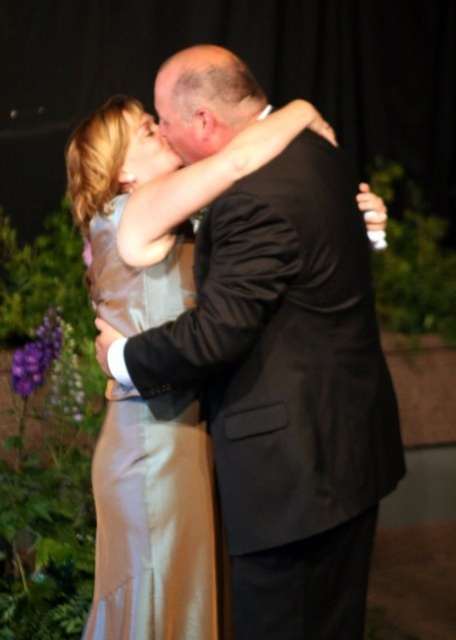
Does satin dress at center appear under satin dress at left?

Incorrect, satin dress at center is not positioned below satin dress at left.

Is satin dress at center to the left of satin dress at left from the viewer's perspective?

Incorrect, satin dress at center is not on the left side of satin dress at left.

Where is `satin dress at center`? satin dress at center is located at coordinates (285, 392).

Does satin dress at center appear over bald head at center?

No.

The image size is (456, 640). What do you see at coordinates (285, 392) in the screenshot?
I see `satin dress at center` at bounding box center [285, 392].

The height and width of the screenshot is (640, 456). I want to click on satin dress at center, so click(x=285, y=392).

Does satin dress at left lie behind bald head at center?

Yes, satin dress at left is behind bald head at center.

You are a GUI agent. You are given a task and a screenshot of the screen. Output one action in this format:
    pyautogui.click(x=<x>, y=<y>)
    Task: Click on the satin dress at left
    Image resolution: width=456 pixels, height=640 pixels.
    Given the screenshot: What is the action you would take?
    click(x=155, y=524)